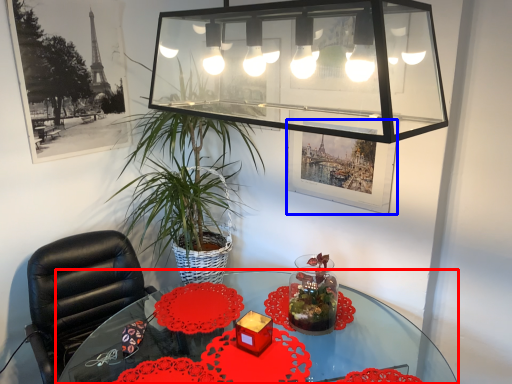
Question: Which object is closer to the camera taking this photo, table (highlighted by a red box) or picture frame (highlighted by a blue box)?

Choices:
 (A) table
 (B) picture frame

Answer: (A)